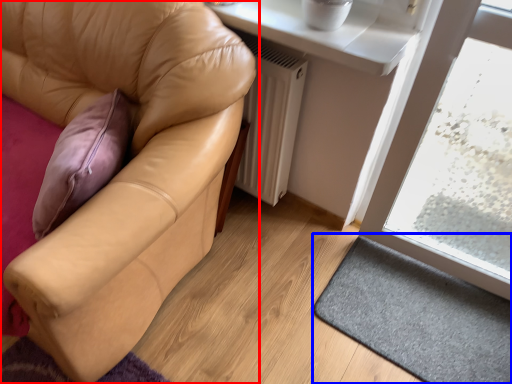
Question: Which object appears closest to the camera in this image, studio couch (highlighted by a red box) or doormat (highlighted by a blue box)?

Choices:
 (A) studio couch
 (B) doormat

Answer: (A)